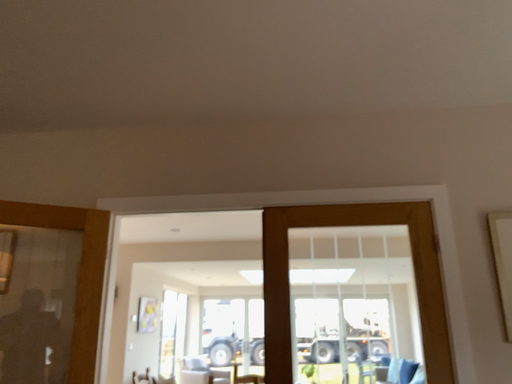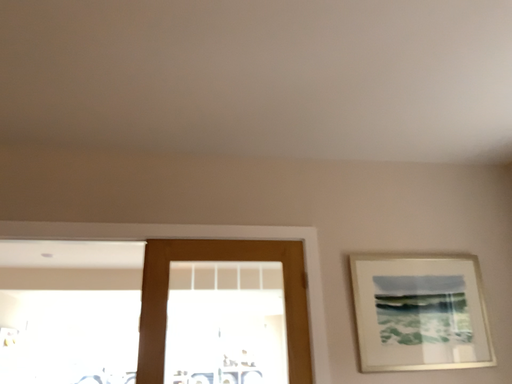
Question: Which way did the camera rotate in the video?

Choices:
 (A) rotated right
 (B) rotated left

Answer: (A)